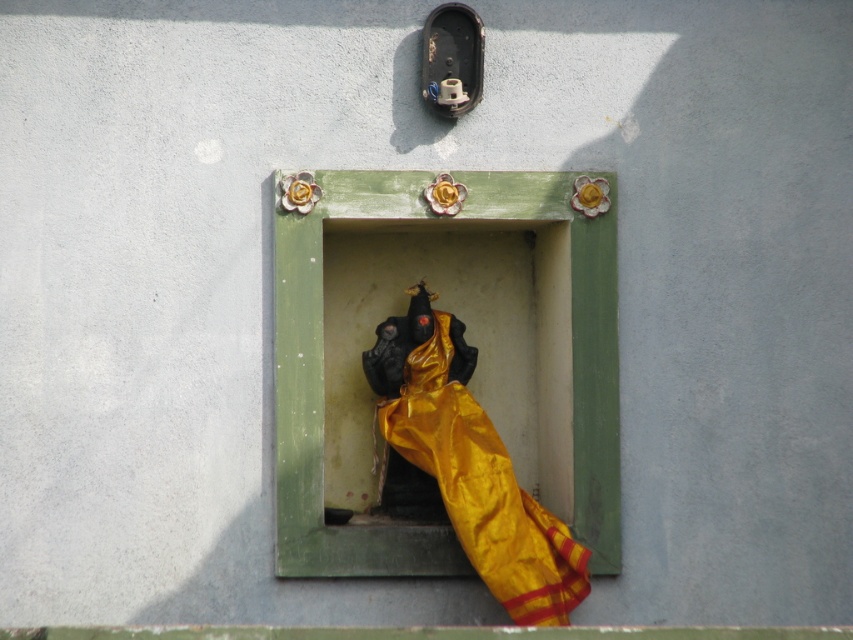
You are an interior designer assessing the placement of items in the niche. The green painted wood at center forms the frame of the niche, and the gold silk cloth at center drapes over the statue inside. Which object occupies more horizontal space within the niche?

The green painted wood at center has a larger width than the gold silk cloth at center, so it occupies more horizontal space within the niche.

You are an interior designer planning to place a new decorative item in the niche. You have a small vase that needs to be placed between the green painted wood at center and the gold silk cloth at center. Based on their positions, where should you place the vase?

The green painted wood at center is positioned on the left side of gold silk cloth at center, so you should place the vase between them, to the right of the green painted wood at center and to the left of the gold silk cloth at center.

You are an interior designer planning to place a new 15 cm wide decorative item on the green painted wood at center. Can you confirm if there is enough space?

The green painted wood at center is located at point (537, 365), but without knowing its dimensions, it is impossible to determine if it can accommodate the 15 cm wide item. Additional measurements are needed.